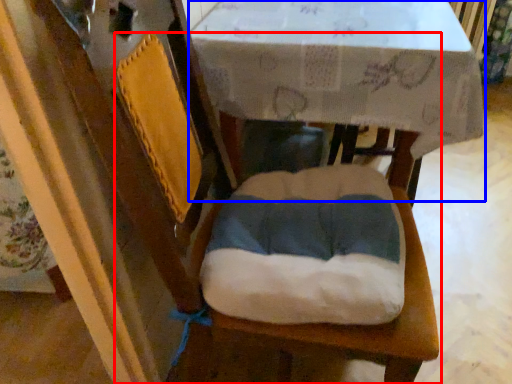
Question: Which point is closer to the camera, chair (highlighted by a red box) or round table (highlighted by a blue box)?

Choices:
 (A) chair
 (B) round table

Answer: (B)